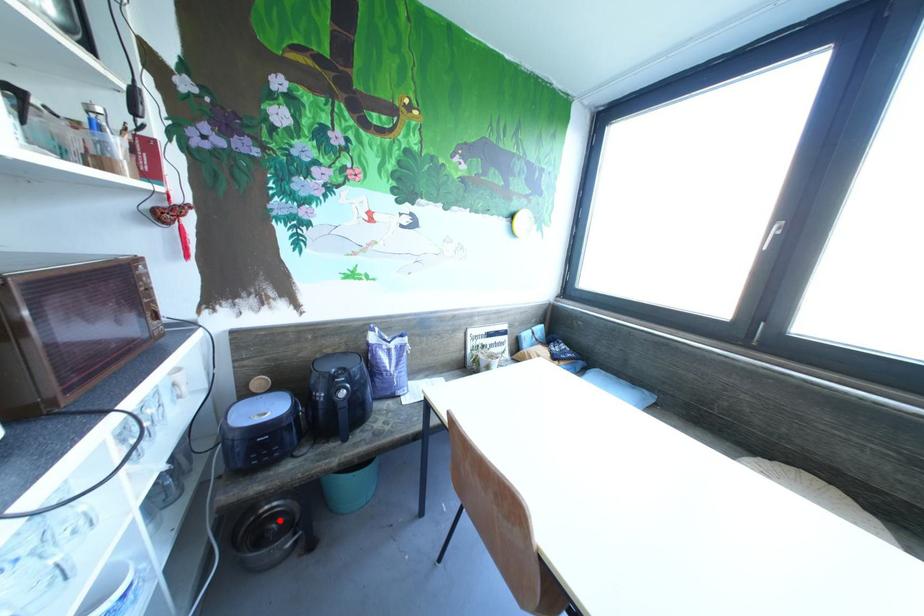
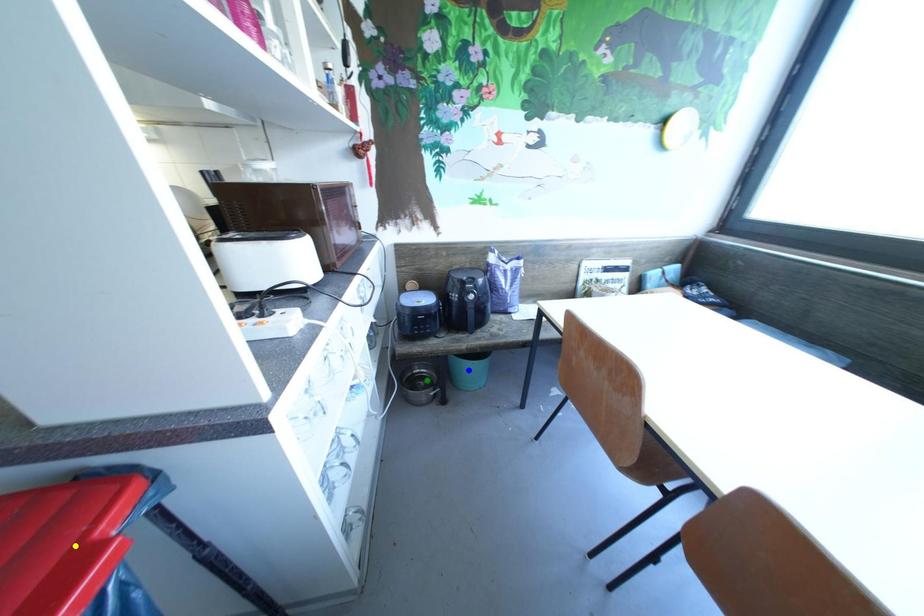
Question: I am providing you with two images of the same scene from different viewpoints. A red point is marked on the first image. You are given multiple points on the second image. Which point in image 2 is actually the same real-world point as the red point in image 1?

Choices:
 (A) blue point
 (B) green point
 (C) yellow point

Answer: (B)